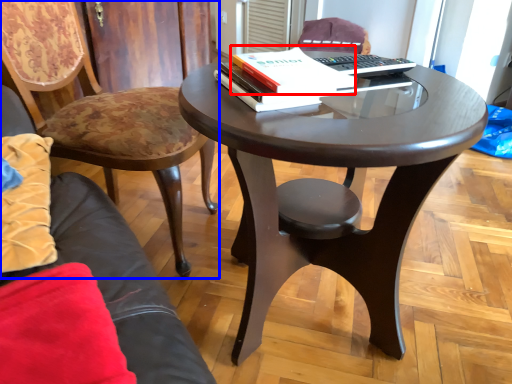
Question: Which of the following is the farthest to the observer, paperback book (highlighted by a red box) or chair (highlighted by a blue box)?

Choices:
 (A) paperback book
 (B) chair

Answer: (B)